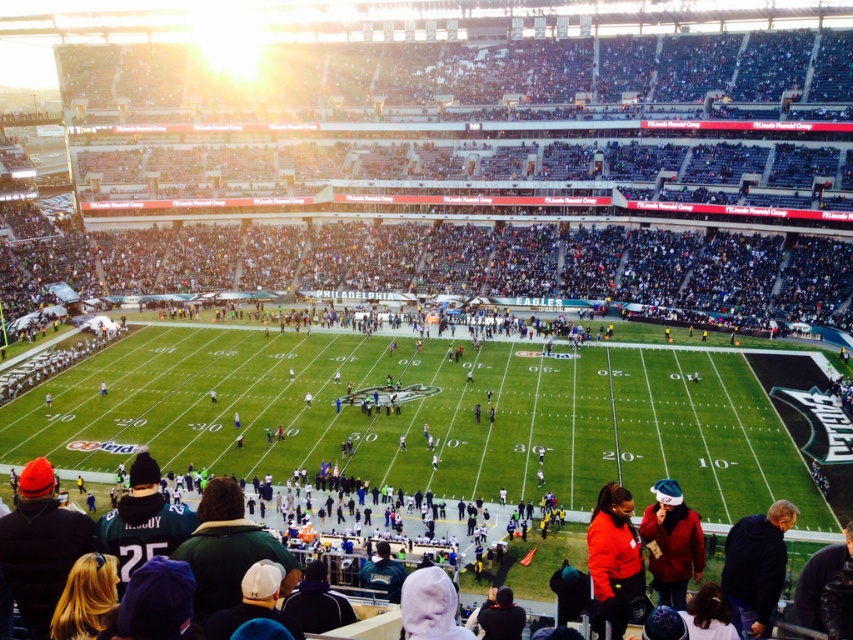
Consider the image. You are a photographer standing on the field at the football stadium. You notice two jackets left behind by fans. The orange fleece jacket at lower center and the red matte jacket at lower right. Which jacket would be easier to fold and pack into a small camera bag?

The orange fleece jacket at lower center is thinner than the red matte jacket at lower right, so it would be easier to fold and pack into a small camera bag.

You are a photographer standing at the edge of the football field. You want to take a photo that includes both the orange fleece jacket at lower center and the red matte jacket at lower right. Which jacket should you pan your camera to the left to include first?

The orange fleece jacket at lower center should be panned to the left first since it is positioned on the left side of the red matte jacket at lower right.

You are a photographer standing at the center of the football field. You want to take a photo of the point at coordinates point [605,602]. Given that your camera has a maximum focus range of 30 meters, will you be able to focus on that point?

The distance of point [605,602] from camera is 33.19 meters, which exceeds the camera maximum focus range of 30 meters. So you cannot focus on that point.